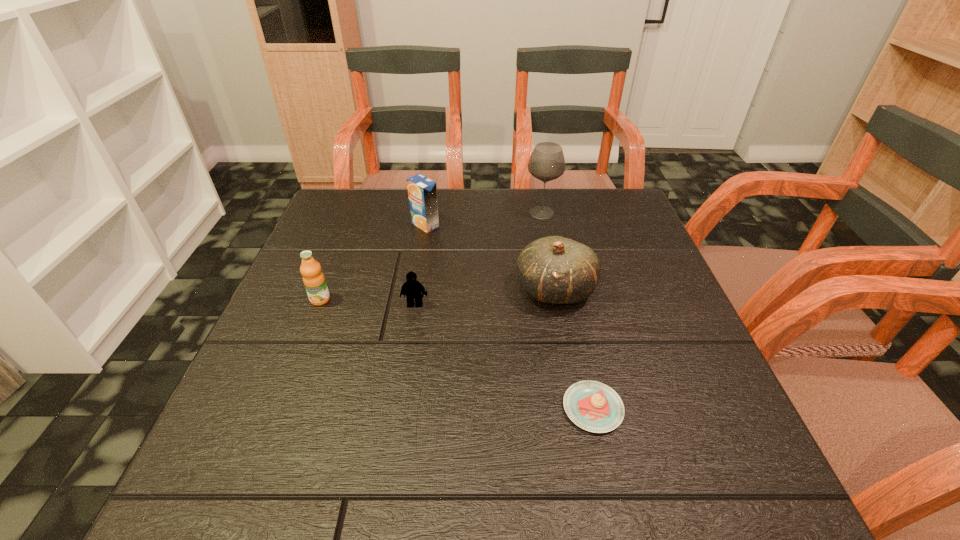
Identify the location of vacant area between the nearer orange juice and the gourd. (438, 294).

The image size is (960, 540). I want to click on object that stands as the fifth closest to the right orange juice, so click(593, 406).

Locate an element on the screen. The height and width of the screenshot is (540, 960). the closest object relative to the tallest object is located at coordinates (557, 270).

What are the coordinates of `vacant space that satisfies the following two spatial constraints: 1. on the label of the leftmost object; 2. on the left side of the shortest object` in the screenshot? It's located at (277, 408).

This screenshot has width=960, height=540. I want to click on free space that satisfies the following two spatial constraints: 1. on the front side of the right orange juice; 2. on the left side of the gourd, so click(415, 289).

The width and height of the screenshot is (960, 540). In order to click on blank area in the image that satisfies the following two spatial constraints: 1. on the front side of the nearest object; 2. on the right side of the gourd in this screenshot , I will do `click(577, 408)`.